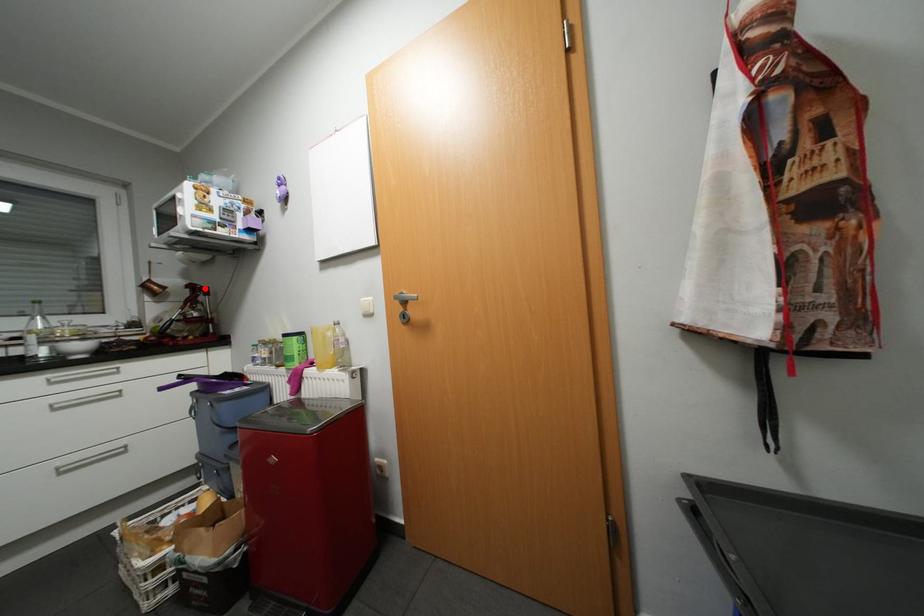
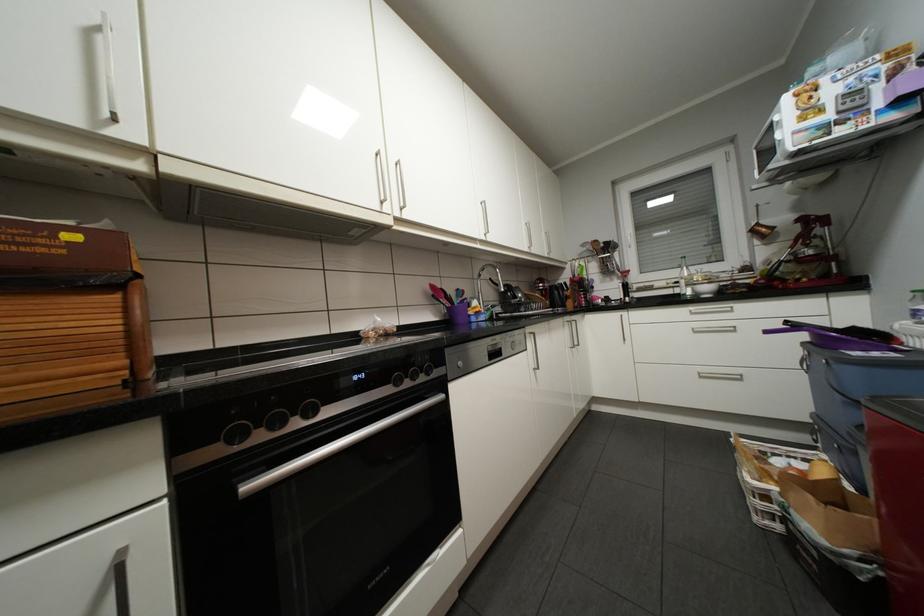
Locate, in the second image, the point that corresponds to the highlighted location in the first image.

(819, 220)